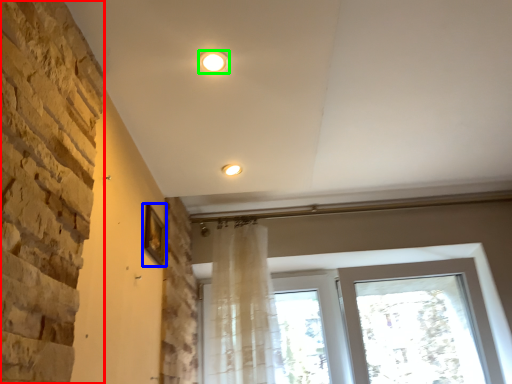
Question: Considering the real-world distances, which object is farthest from brickwork (highlighted by a red box)? picture frame (highlighted by a blue box) or lighting (highlighted by a green box)?

Choices:
 (A) picture frame
 (B) lighting

Answer: (A)